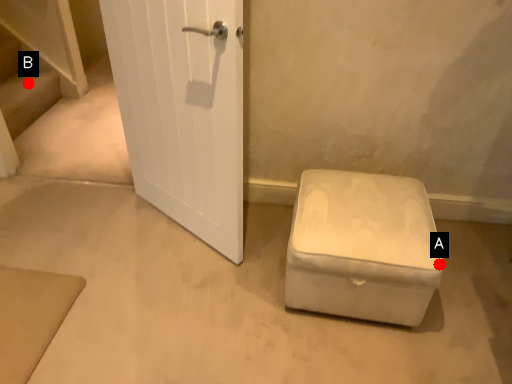
Question: Two points are circled on the image, labeled by A and B beside each circle. Which point is closer to the camera?

Choices:
 (A) A is closer
 (B) B is closer

Answer: (A)